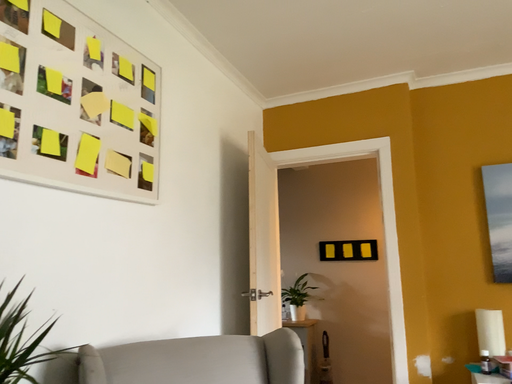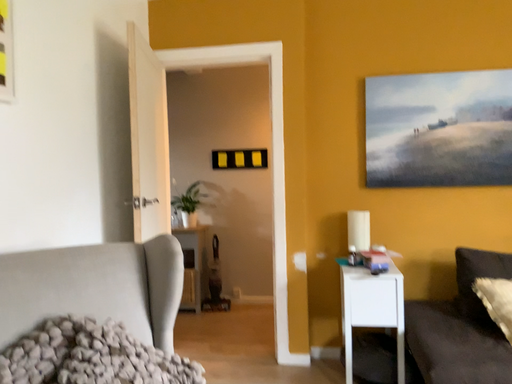
Question: Which way did the camera rotate in the video?

Choices:
 (A) rotated left
 (B) rotated right

Answer: (B)